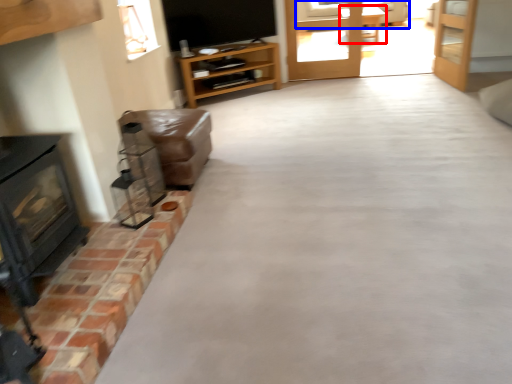
Question: Which object is further to the camera taking this photo, table (highlighted by a red box) or couch (highlighted by a blue box)?

Choices:
 (A) table
 (B) couch

Answer: (B)